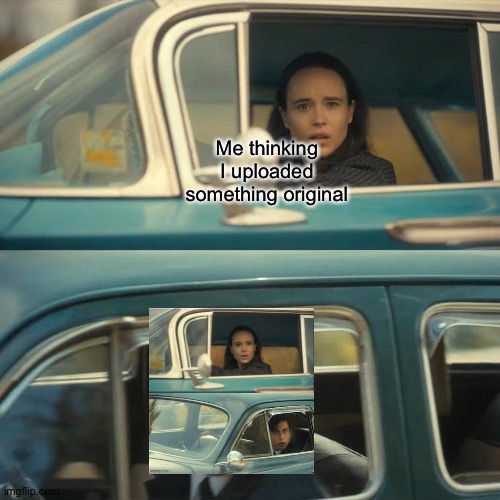
Where is `open window`? The width and height of the screenshot is (500, 500). open window is located at coordinates (414, 137), (292, 434), (273, 350).